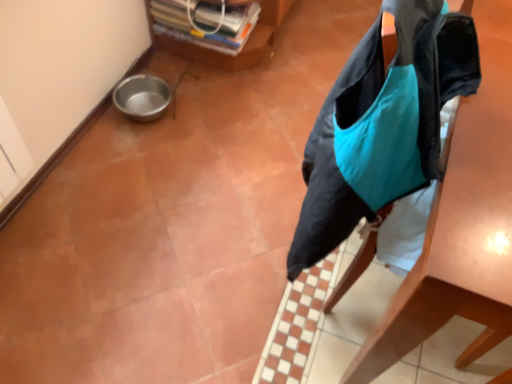
The width and height of the screenshot is (512, 384). I want to click on vacant space situated on the left part of teal fabric bag at right, which is counted as the 2th furniture, starting from the left, so click(x=188, y=207).